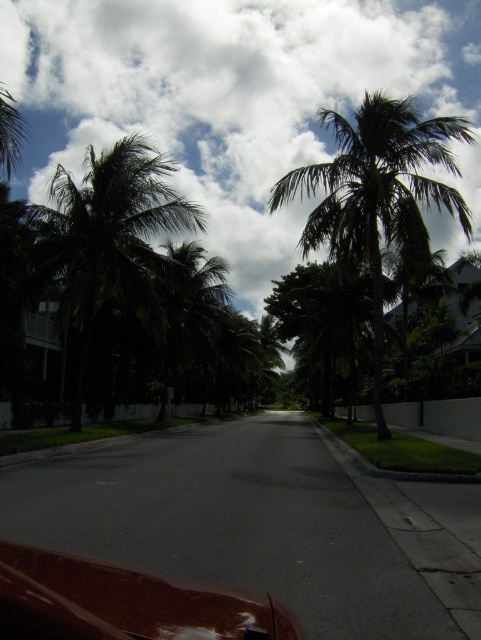
Question: Which object is farther from the camera taking this photo?

Choices:
 (A) glossy brown car at lower left
 (B) green leafy palm tree at upper left
 (C) white fluffy cloud at upper center

Answer: (C)

Question: Can you confirm if white fluffy cloud at upper center is positioned above green leafy palm tree at upper left?

Choices:
 (A) yes
 (B) no

Answer: (A)

Question: Is white fluffy cloud at upper center thinner than glossy brown car at lower left?

Choices:
 (A) yes
 (B) no

Answer: (B)

Question: Does white fluffy cloud at upper center have a lesser width compared to glossy brown car at lower left?

Choices:
 (A) no
 (B) yes

Answer: (A)

Question: Which point is farther to the camera?

Choices:
 (A) glossy brown car at lower left
 (B) green leafy palm tree at center

Answer: (B)

Question: Considering the real-world distances, which object is closest to the green leafy palm tree at center?

Choices:
 (A) glossy brown car at lower left
 (B) green leafy palm tree at upper left
 (C) white fluffy cloud at upper center

Answer: (B)